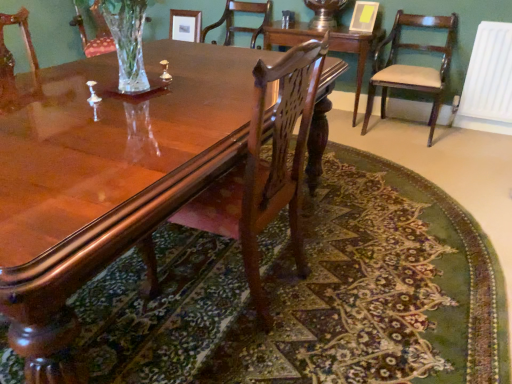
Identify the location of vacant space that's between mahogany wood chair at right, positioned as the second chair in front-to-back order, and white plastic radiator at right. (458, 139).